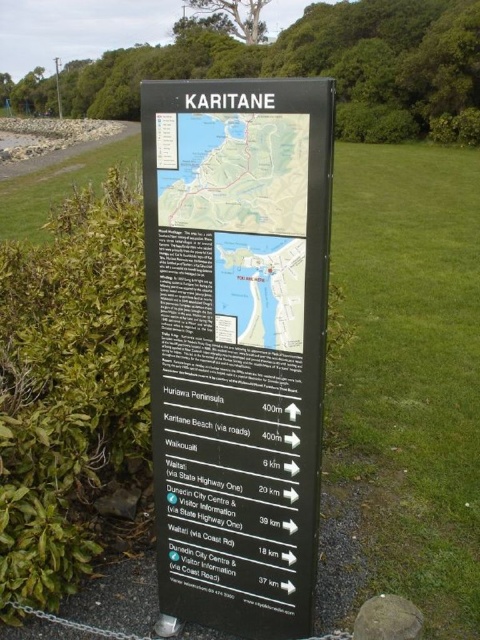
You are standing in front of the black directional signpost in Karitane. You notice the black plastic sign at center and the matte plastic map at center. Which one is positioned higher up on the signpost?

The matte plastic map at center is positioned higher up on the signpost because the black plastic sign at center is located below it.